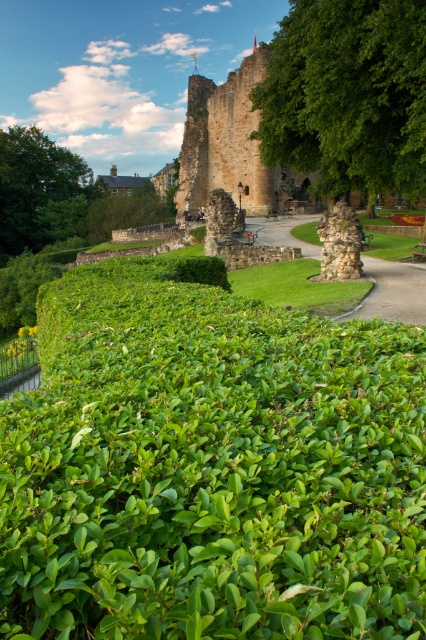
Does green leafy tree at center have a lesser height compared to green leafy tree at upper left?

Correct, green leafy tree at center is not as tall as green leafy tree at upper left.

You are a GUI agent. You are given a task and a screenshot of the screen. Output one action in this format:
    pyautogui.click(x=<x>, y=<y>)
    Task: Click on the green leafy tree at center
    
    Given the screenshot: What is the action you would take?
    pyautogui.click(x=348, y=93)

Describe the element at coordinates (348, 93) in the screenshot. The image size is (426, 640). I see `green leafy tree at center` at that location.

Identify the location of green leafy tree at center. This screenshot has width=426, height=640. (348, 93).